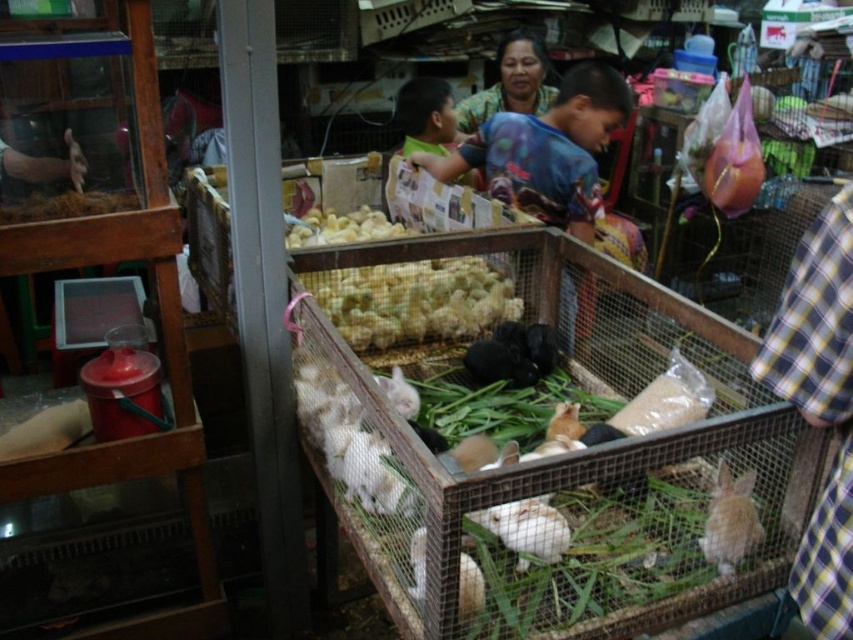
Can you confirm if blue printed shirt at center is positioned below white fur rabbit at center?

No.

Between point (538, 164) and point (476, 564), which one is positioned in front?

Point (476, 564) is in front.

Between point (590, 218) and point (422, 528), which one is positioned in front?

Point (422, 528)

Identify the location of blue printed shirt at center. (546, 150).

Is yellow soft hay at center thinner than white fur rabbit at center?

No, yellow soft hay at center is not thinner than white fur rabbit at center.

How much distance is there between yellow soft hay at center and white fur rabbit at center?

yellow soft hay at center and white fur rabbit at center are 90.29 centimeters apart.

Is point (384, 317) farther from camera compared to point (416, 545)?

Yes, point (384, 317) is behind point (416, 545).

Image resolution: width=853 pixels, height=640 pixels. I want to click on yellow soft hay at center, so click(x=413, y=300).

Does green plaid shirt at upper center have a greater width compared to white fluffy rabbit at center?

Yes, green plaid shirt at upper center is wider than white fluffy rabbit at center.

Does green plaid shirt at upper center have a larger size compared to white fluffy rabbit at center?

Correct, green plaid shirt at upper center is larger in size than white fluffy rabbit at center.

This screenshot has width=853, height=640. What are the coordinates of `green plaid shirt at upper center` in the screenshot? It's located at (509, 83).